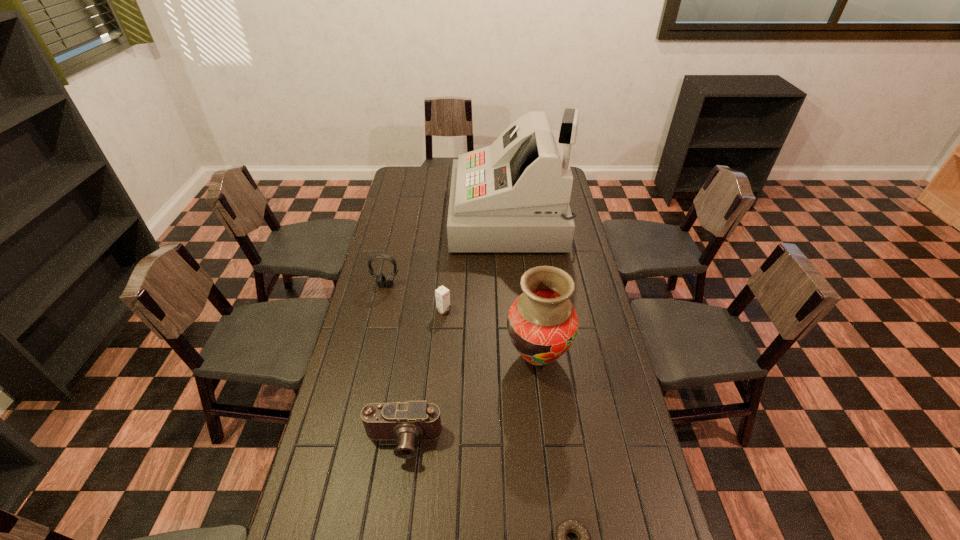
At what (x,y) coordinates should I click in order to perform the action: click on object at the far right corner. Please return your answer as a coordinate pair (x, y). Looking at the image, I should click on (513, 196).

The image size is (960, 540). I want to click on blank space at the left edge, so [x=403, y=244].

Where is `vacant space at the far left corner`? vacant space at the far left corner is located at coordinates (413, 182).

Identify the location of free area in between the fourth shortest object and the chocolate milk. This screenshot has height=540, width=960. (415, 298).

Where is `blank region between the vase and the fourth nearest object`? blank region between the vase and the fourth nearest object is located at coordinates (491, 333).

At what (x,y) coordinates should I click in order to perform the action: click on vacant space that's between the camera and the fifth nearest object. Please return your answer as a coordinate pair (x, y). The width and height of the screenshot is (960, 540). Looking at the image, I should click on (395, 363).

Select which object appears as the third closest to the third nearest object. Please provide its 2D coordinates. Your answer should be formatted as a tuple, i.e. [(x, y)], where the tuple contains the x and y coordinates of a point satisfying the conditions above.

[(566, 526)]

Locate which object is the fourth closest to the farthest object. Please provide its 2D coordinates. Your answer should be formatted as a tuple, i.e. [(x, y)], where the tuple contains the x and y coordinates of a point satisfying the conditions above.

[(406, 422)]

Identify the location of free region that satisfies the following two spatial constraints: 1. on the front-facing side of the chocolate milk; 2. on the right side of the fifth nearest object. This screenshot has width=960, height=540. (380, 310).

I want to click on vacant region that satisfies the following two spatial constraints: 1. on the front-facing side of the third nearest object; 2. on the right side of the fourth shortest object, so click(x=370, y=356).